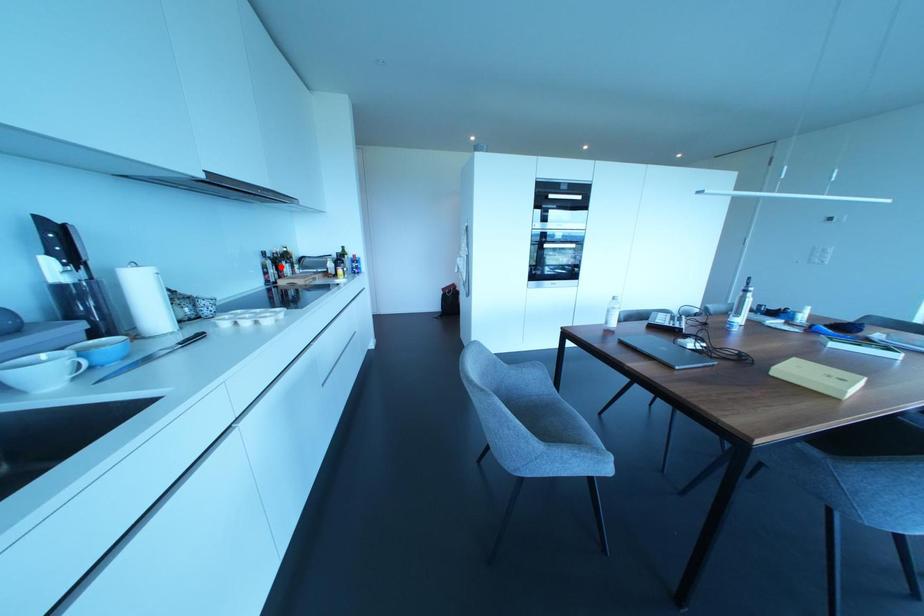
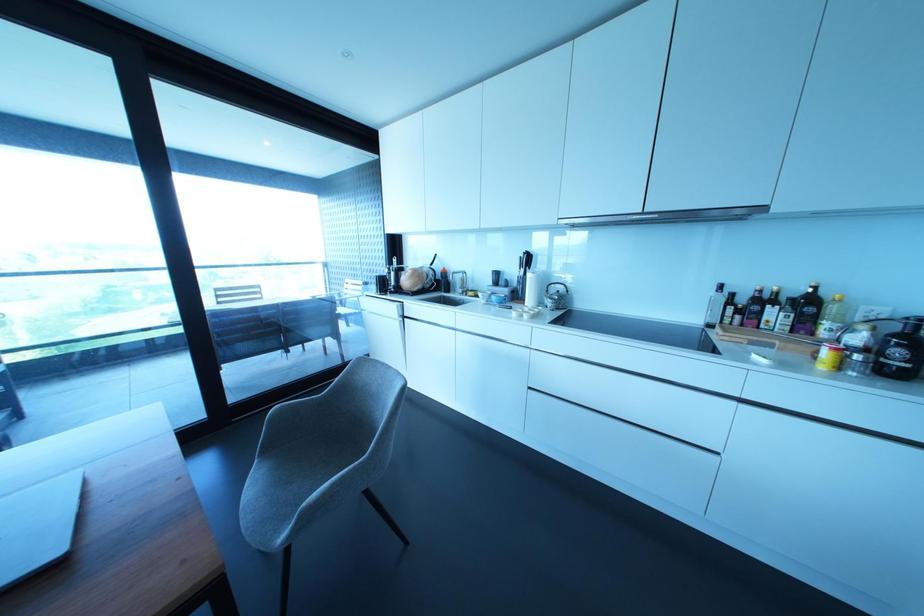
The point at the highlighted location is marked in the first image. Where is the corresponding point in the second image?

(760, 313)